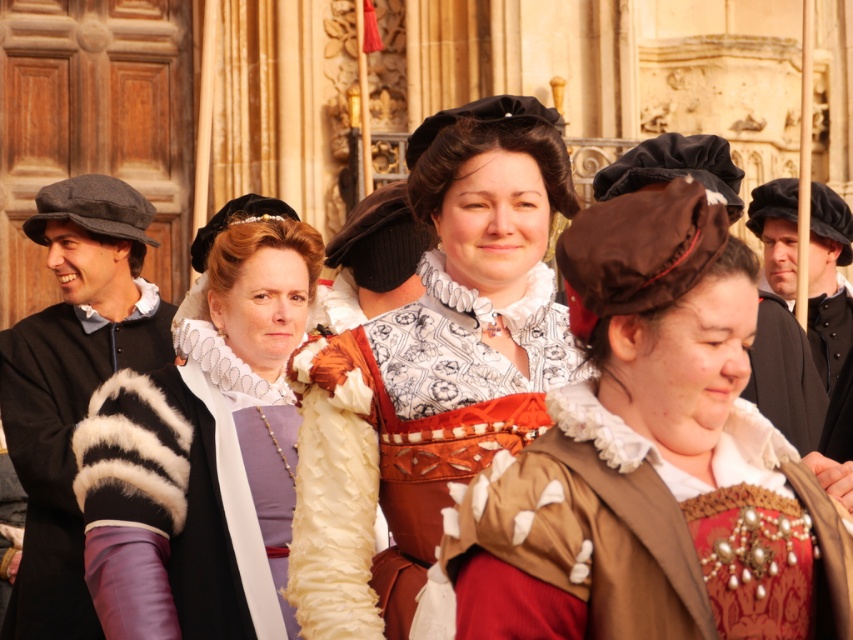
Between point (250, 504) and point (599, 195), which one is positioned in front?

Positioned in front is point (250, 504).

Between point (276, 582) and point (614, 173), which one is positioned behind?

Positioned behind is point (614, 173).

Is point (132, 497) positioned in front of point (779, 394)?

Yes, point (132, 497) is closer to viewer.

Find the location of a particular element. Image resolution: width=853 pixels, height=640 pixels. white fur coat at center is located at coordinates (204, 448).

Who is more forward, (488, 179) or (782, 317)?

Point (488, 179) is in front.

Based on the photo, can you confirm if matte white ruffled collar at center is positioned above brown felt hat at center?

No, matte white ruffled collar at center is not above brown felt hat at center.

Does point (457, 480) come in front of point (819, 401)?

That is True.

Locate an element on the screen. This screenshot has width=853, height=640. matte white ruffled collar at center is located at coordinates (433, 368).

Is point (378, 563) farther from viewer compared to point (213, 449)?

No, it is in front of (213, 449).

Between matte white ruffled collar at center and white fur coat at center, which one is positioned lower?

white fur coat at center is below.

Is point (401, 604) positioned in front of point (105, 419)?

Yes, it is in front of point (105, 419).

The image size is (853, 640). I want to click on matte white ruffled collar at center, so click(x=433, y=368).